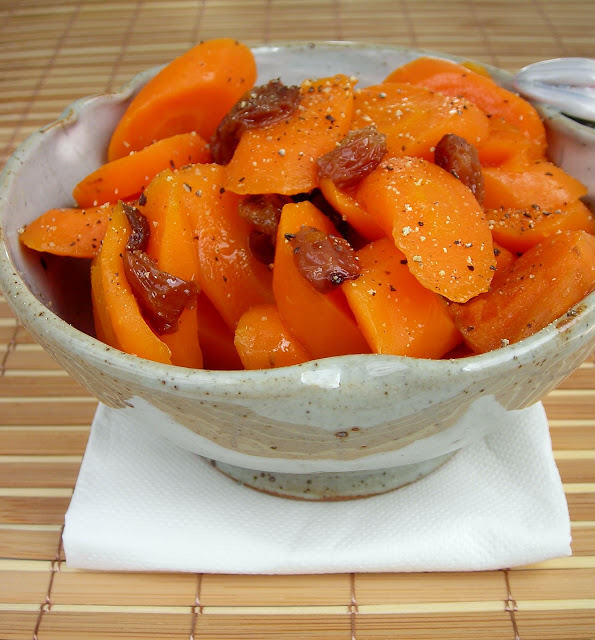
Locate an element on the screen. This screenshot has height=640, width=595. pattern on bowl is located at coordinates (99, 380), (269, 442), (528, 380).